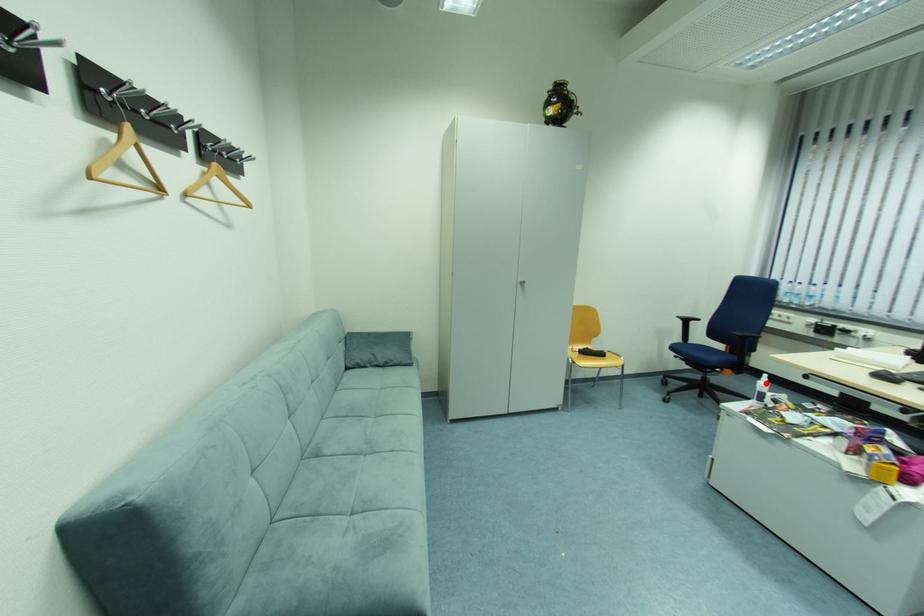
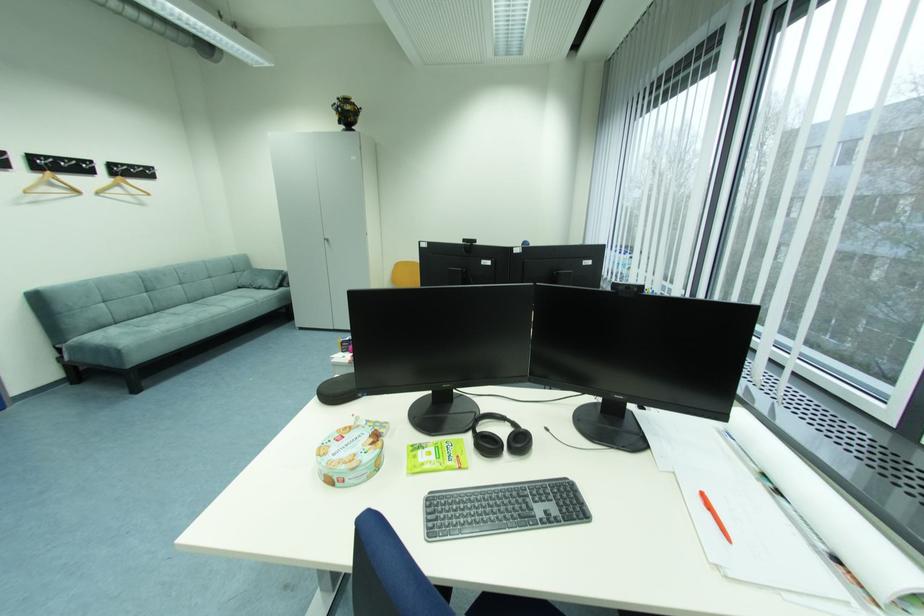
Question: I am providing you with two images of the same scene from different viewpoints. A red point is marked on the first image. Can you still see the location of the red point in image 2?

Choices:
 (A) Yes
 (B) No

Answer: (B)